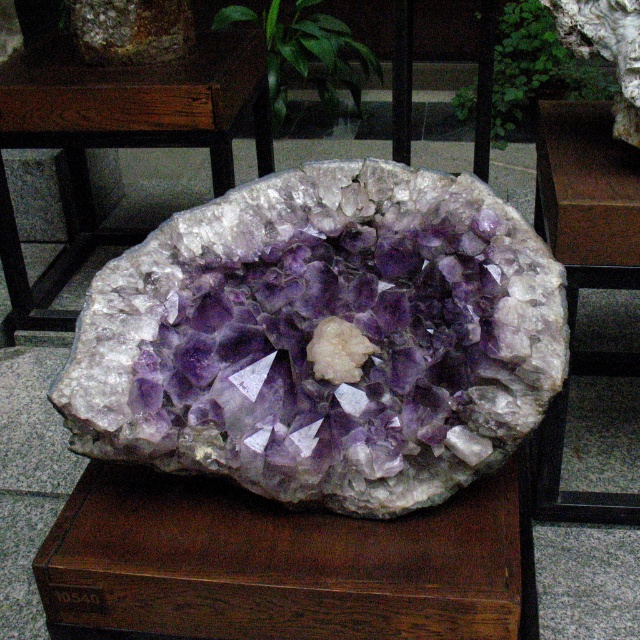
Question: Which is farther from the purple crystal cluster at center?

Choices:
 (A) wooden table at center
 (B) wooden box at center

Answer: (A)

Question: From the image, what is the correct spatial relationship of wooden box at center in relation to wooden table at center?

Choices:
 (A) right
 (B) left

Answer: (A)

Question: Among these points, which one is farthest from the camera?

Choices:
 (A) 132,141
 (B) 268,392

Answer: (A)

Question: Is purple crystal cluster at center to the right of wooden table at center from the viewer's perspective?

Choices:
 (A) yes
 (B) no

Answer: (A)

Question: Does purple crystal cluster at center have a larger size compared to wooden table at center?

Choices:
 (A) no
 (B) yes

Answer: (A)

Question: Estimate the real-world distances between objects in this image. Which object is farther from the purple crystal cluster at center?

Choices:
 (A) wooden box at center
 (B) wooden table at center

Answer: (B)